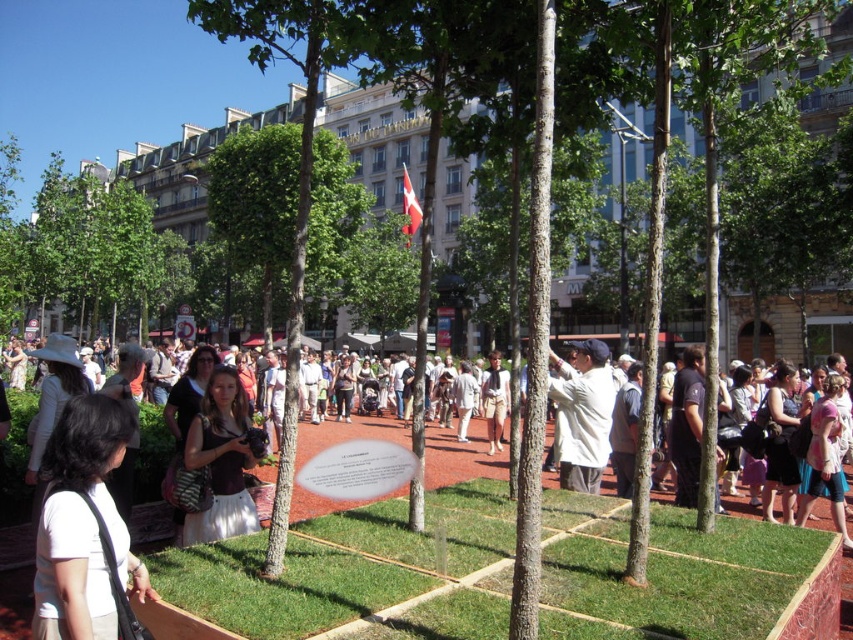
Question: From the image, what is the correct spatial relationship of brown leather purse at center in relation to white cotton shirt at center?

Choices:
 (A) above
 (B) below

Answer: (B)

Question: Is brown leather purse at center above white fabric bag at center?

Choices:
 (A) yes
 (B) no

Answer: (B)

Question: Does brown leather purse at center have a smaller size compared to beige fabric dress at center?

Choices:
 (A) no
 (B) yes

Answer: (B)

Question: Which object is farther from the camera taking this photo?

Choices:
 (A) green grass at center
 (B) beige fabric dress at center
 (C) brown leather purse at center

Answer: (B)

Question: Based on their relative distances, which object is nearer to the beige fabric dress at center?

Choices:
 (A) green grass at center
 (B) white cotton shirt at center
 (C) white fabric bag at lower left
 (D) white fabric bag at center

Answer: (D)

Question: Which point is farther from the camera taking this photo?

Choices:
 (A) (230, 476)
 (B) (585, 426)
 (C) (93, 602)

Answer: (B)